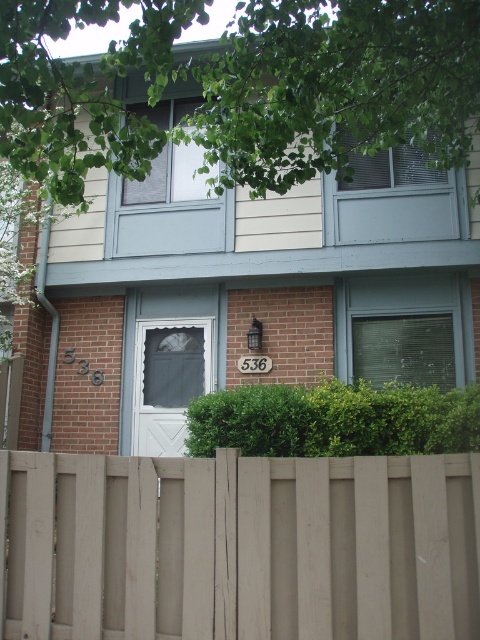
You are a delivery person approaching the house. You need to place a package on the light brown wooden fence at lower center. Is the fence large enough to hold the package if the package is the same size as the white mesh screen door at center?

The light brown wooden fence at lower center has a smaller size compared to the white mesh screen door at center. Therefore, the fence is not large enough to hold a package the size of the white mesh screen door at center.

You are a delivery person approaching the house and need to deliver a package to the front door. The package is too large to fit through the white mesh screen door at center. Can you place the package in front of the green leafy hedge at center instead?

The green leafy hedge at center is bigger than the white mesh screen door at center, so yes, you can place the package in front of the green leafy hedge at center because it is larger and provides enough space.

You are standing in front of the house and want to know the exact position of the light brown wooden fence at lower center. According to the scene description, where is it located in terms of coordinates?

The light brown wooden fence at lower center is located at coordinates point [240,547].